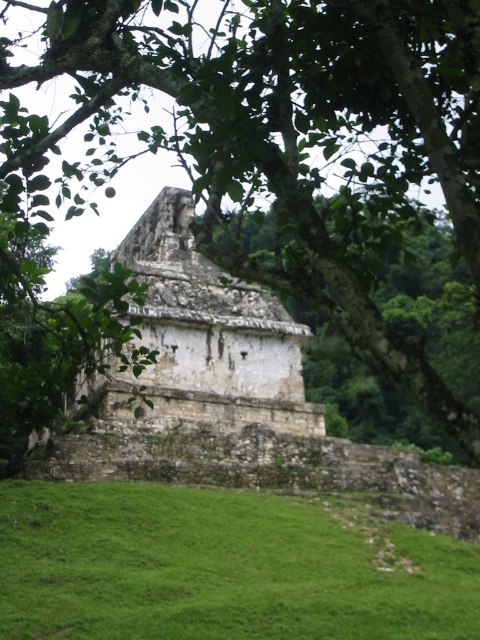
Can you confirm if green leafy tree at center is positioned to the left of green grassy hillside at lower center?

In fact, green leafy tree at center is to the right of green grassy hillside at lower center.

Is green leafy tree at center below green grassy hillside at lower center?

Incorrect, green leafy tree at center is not positioned below green grassy hillside at lower center.

Between point (358, 342) and point (450, 572), which one is positioned in front?

Point (358, 342) is more forward.

This screenshot has height=640, width=480. Find the location of `green leafy tree at center`. green leafy tree at center is located at coordinates (280, 138).

Is green leafy tree at center thinner than stone temple at center?

Incorrect, green leafy tree at center's width is not less than stone temple at center's.

Does green leafy tree at center have a greater width compared to stone temple at center?

Indeed, green leafy tree at center has a greater width compared to stone temple at center.

Does point (296, 76) come closer to viewer compared to point (263, 312)?

Yes, it is in front of point (263, 312).

At what (x,y) coordinates should I click in order to perform the action: click on green leafy tree at center. Please return your answer as a coordinate pair (x, y). The image size is (480, 640). Looking at the image, I should click on (280, 138).

Does green grassy hillside at lower center appear over stone temple at center?

Incorrect, green grassy hillside at lower center is not positioned above stone temple at center.

Who is higher up, green grassy hillside at lower center or stone temple at center?

stone temple at center is above.

Is point (267, 556) positioned in front of point (172, 273)?

Yes, point (267, 556) is closer to viewer.

You are a GUI agent. You are given a task and a screenshot of the screen. Output one action in this format:
    pyautogui.click(x=<x>, y=<y>)
    Task: Click on the green grassy hillside at lower center
    The height and width of the screenshot is (640, 480).
    Given the screenshot: What is the action you would take?
    pyautogui.click(x=222, y=566)